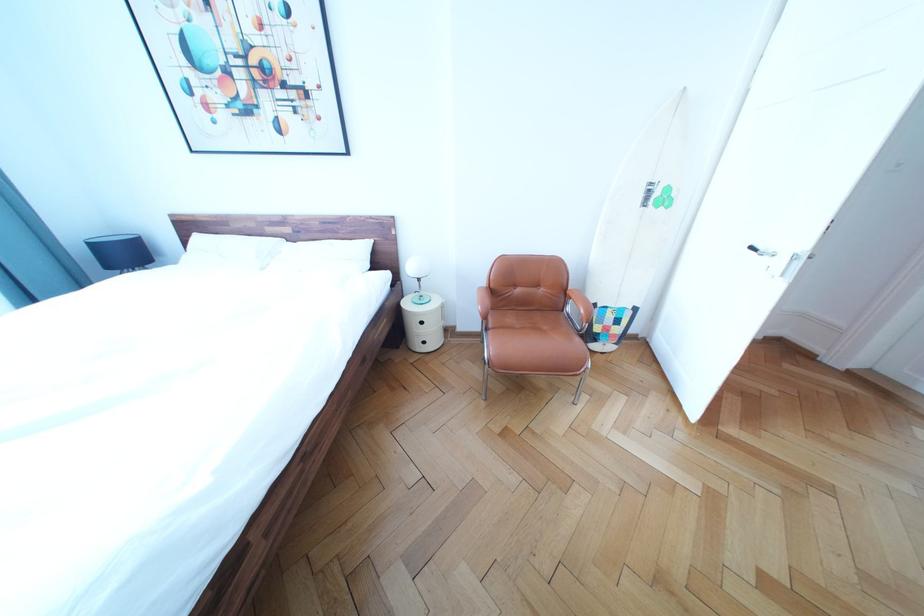
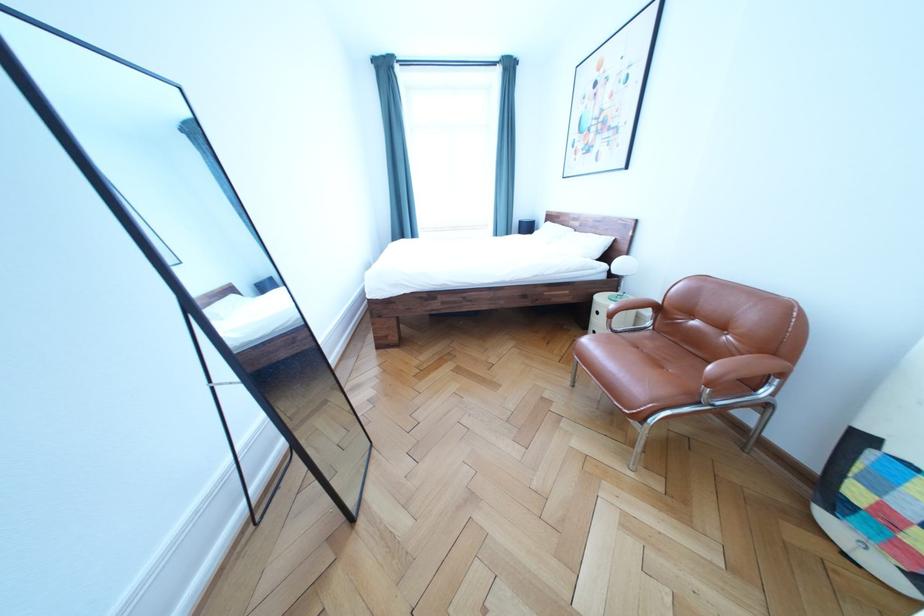
Where in the second image is the point corresponding to pixel 529 296 from the first image?

(706, 329)